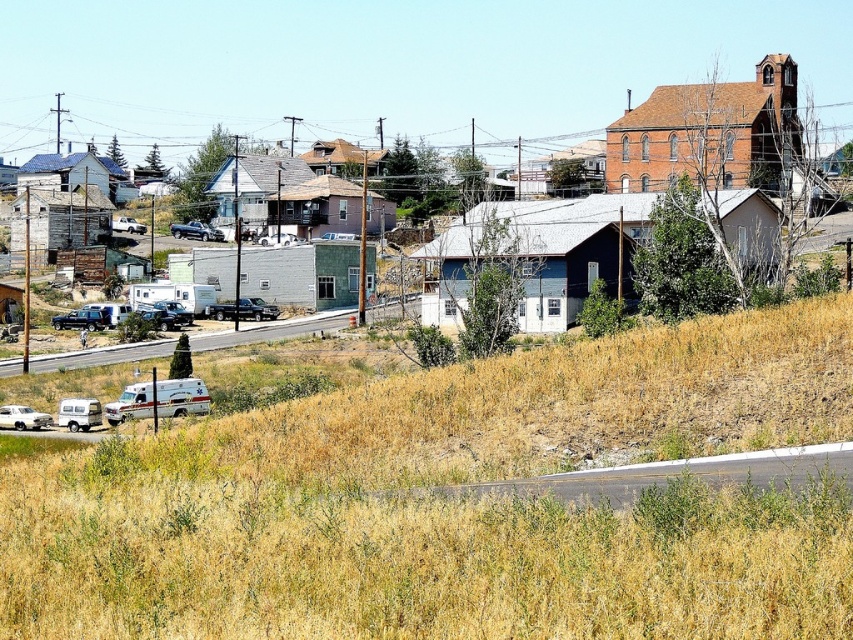
You are standing at the origin point in the image and want to reach the dry grass at lower center. What are the coordinates you need to move to?

The dry grass at lower center is located at coordinates point (x=459, y=502).

You are standing in the residential area and need to determine which object is smaller between the dry grass at lower center and the matte gray building at center. Can you identify the smaller one?

The dry grass at lower center is smaller than the matte gray building at center, so the dry grass at lower center is the smaller object.